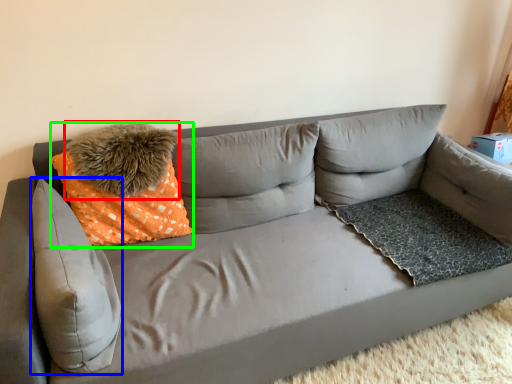
Question: Based on their relative distances, which object is farther from pillow (highlighted by a red box)? Choose from pillow (highlighted by a blue box) and throw pillow (highlighted by a green box).

Choices:
 (A) pillow
 (B) throw pillow

Answer: (A)